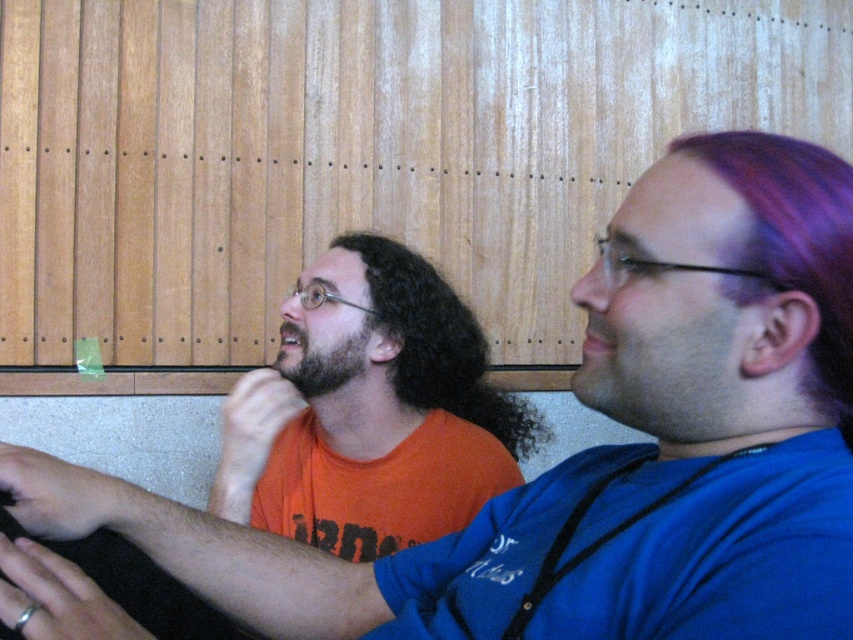
You are a photographer standing in front of the two people in the image. You want to take a photo where both the purple dyed hair at right and the curly brown hair at center are clearly visible. Is the current arrangement of the two people blocking either of their hair from view?

The purple dyed hair at right is in front of curly brown hair at center, so the purple dyed hair at right may be blocking part of the curly brown hair at center from view. Adjust their positions to ensure both are visible.